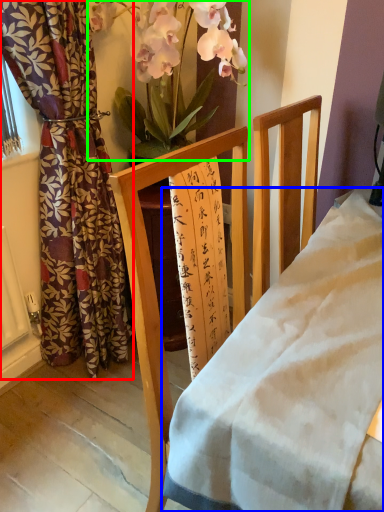
Question: Estimate the real-world distances between objects in this image. Which object is farther from curtain (highlighted by a red box), desk (highlighted by a blue box) or floral arrangement (highlighted by a green box)?

Choices:
 (A) desk
 (B) floral arrangement

Answer: (A)